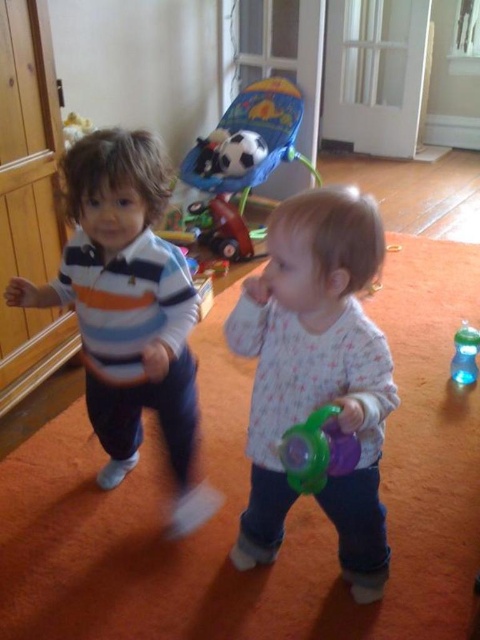
Question: Which of these objects is positioned closest to the purple plastic sippy cup at center?

Choices:
 (A) transparent plastic sippy cup at lower right
 (B) wooden toy car at center
 (C) striped cotton shirt at center
 (D) translucent green sippy cup at center

Answer: (D)

Question: Is purple plastic sippy cup at center wider than wooden toy car at center?

Choices:
 (A) no
 (B) yes

Answer: (B)

Question: Does striped cotton shirt at center have a greater width compared to transparent plastic sippy cup at lower right?

Choices:
 (A) no
 (B) yes

Answer: (B)

Question: Which object is closer to the camera taking this photo?

Choices:
 (A) translucent green sippy cup at center
 (B) purple plastic sippy cup at center
 (C) transparent plastic sippy cup at lower right
 (D) plush fabric baby swing at upper center

Answer: (A)

Question: Based on their relative distances, which object is nearer to the translucent green sippy cup at center?

Choices:
 (A) striped cotton shirt at center
 (B) plush fabric baby swing at upper center

Answer: (A)

Question: Is translucent green sippy cup at center bigger than transparent plastic sippy cup at lower right?

Choices:
 (A) no
 (B) yes

Answer: (A)